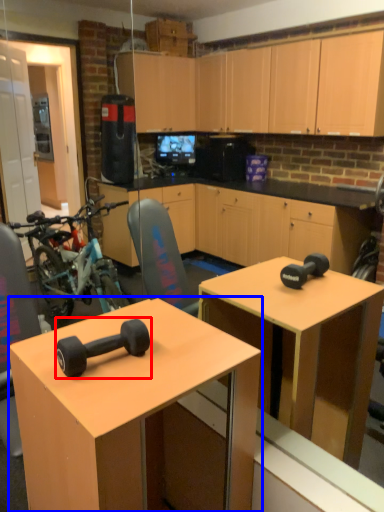
Question: Which object is further to the camera taking this photo, dumbbell (highlighted by a red box) or desk (highlighted by a blue box)?

Choices:
 (A) dumbbell
 (B) desk

Answer: (A)